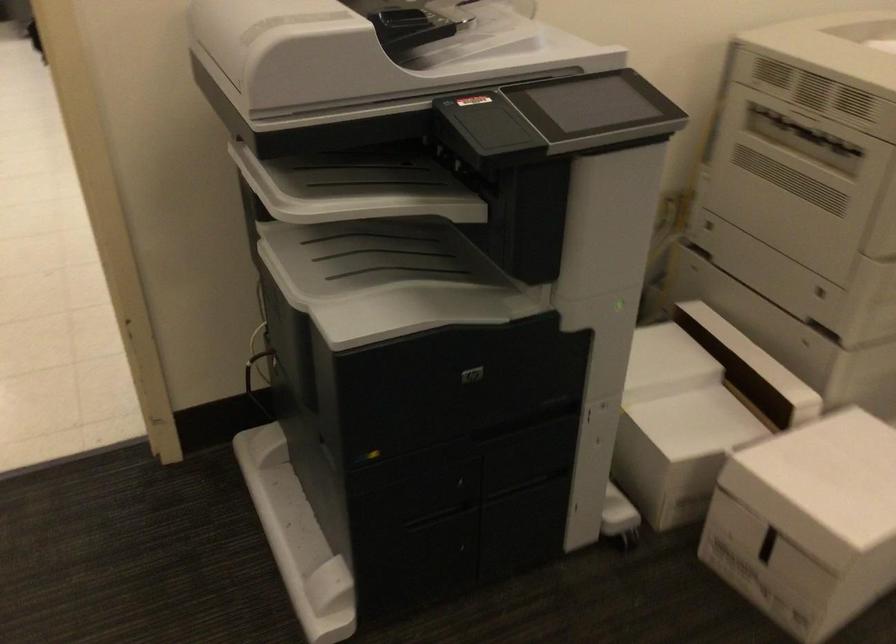
Find where to retriev the printer output slot. Please return your answer as a coordinate pair (x, y).

(451, 29)